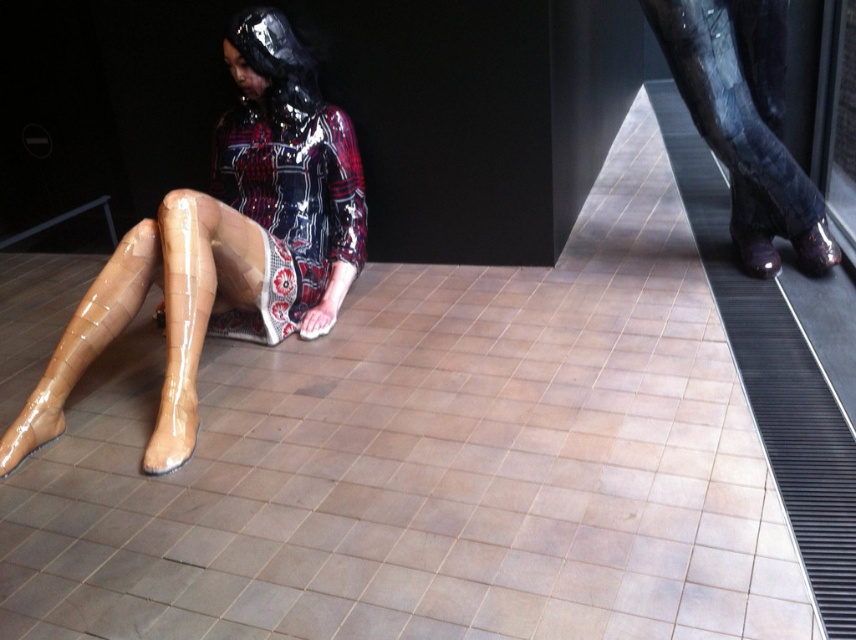
Does glossy tan boots at lower left have a lesser width compared to glossy black boot at upper right?

In fact, glossy tan boots at lower left might be wider than glossy black boot at upper right.

Looking at this image, is glossy tan boots at lower left wider than glossy black boot at upper right?

Indeed, glossy tan boots at lower left has a greater width compared to glossy black boot at upper right.

Which is behind, point (259, 83) or point (776, 227)?

The point (259, 83) is behind.

Identify the location of glossy tan boots at lower left. (226, 243).

Can you confirm if glossy black boot at upper right is positioned above glossy tan boot at lower left?

Yes, glossy black boot at upper right is above glossy tan boot at lower left.

Does glossy black boot at upper right have a lesser width compared to glossy tan boot at lower left?

No, glossy black boot at upper right is not thinner than glossy tan boot at lower left.

Between point (738, 234) and point (220, 227), which one is positioned behind?

The point (738, 234) is more distant.

You are a GUI agent. You are given a task and a screenshot of the screen. Output one action in this format:
    pyautogui.click(x=<x>, y=<y>)
    Task: Click on the glossy black boot at upper right
    The image size is (856, 640).
    Given the screenshot: What is the action you would take?
    pyautogui.click(x=745, y=122)

Between point (210, 278) and point (235, 227), which one is positioned behind?

The point (235, 227) is more distant.

Is glossy tan boots at lower left to the left of glossy tan boot at lower left from the viewer's perspective?

Incorrect, glossy tan boots at lower left is not on the left side of glossy tan boot at lower left.

Who is more distant from viewer, (48,396) or (177,356)?

Positioned behind is point (48,396).

Where is `glossy tan boots at lower left`? Image resolution: width=856 pixels, height=640 pixels. glossy tan boots at lower left is located at coordinates (226, 243).